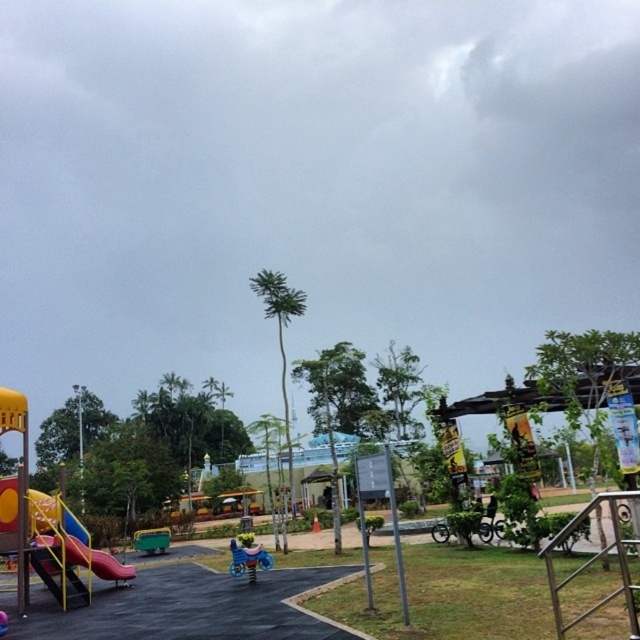
Is multicolored plastic playground at lower left to the left of metallic blue swing at center from the viewer's perspective?

Indeed, multicolored plastic playground at lower left is positioned on the left side of metallic blue swing at center.

This screenshot has height=640, width=640. Describe the element at coordinates (13, 419) in the screenshot. I see `multicolored plastic playground at lower left` at that location.

You are a GUI agent. You are given a task and a screenshot of the screen. Output one action in this format:
    pyautogui.click(x=<x>, y=<y>)
    Task: Click on the multicolored plastic playground at lower left
    This screenshot has width=640, height=640.
    Given the screenshot: What is the action you would take?
    pyautogui.click(x=13, y=419)

You are a GUI agent. You are given a task and a screenshot of the screen. Output one action in this format:
    pyautogui.click(x=<x>, y=<y>)
    Task: Click on the multicolored plastic playground at lower left
    
    Given the screenshot: What is the action you would take?
    pyautogui.click(x=13, y=419)

Does yellow matte slide at lower left have a lesser width compared to metallic blue swing at center?

Yes.

You are a GUI agent. You are given a task and a screenshot of the screen. Output one action in this format:
    pyautogui.click(x=<x>, y=<y>)
    Task: Click on the yellow matte slide at lower left
    
    Given the screenshot: What is the action you would take?
    pyautogui.click(x=70, y=538)

The image size is (640, 640). Identify the location of yellow matte slide at lower left. (70, 538).

Does multicolored plastic playground at lower left lie behind yellow matte slide at lower left?

That is False.

Who is positioned more to the left, multicolored plastic playground at lower left or yellow matte slide at lower left?

From the viewer's perspective, multicolored plastic playground at lower left appears more on the left side.

Find the location of a particular element. Image resolution: width=640 pixels, height=640 pixels. multicolored plastic playground at lower left is located at coordinates (13, 419).

You are a GUI agent. You are given a task and a screenshot of the screen. Output one action in this format:
    pyautogui.click(x=<x>, y=<y>)
    Task: Click on the multicolored plastic playground at lower left
    
    Given the screenshot: What is the action you would take?
    pyautogui.click(x=13, y=419)